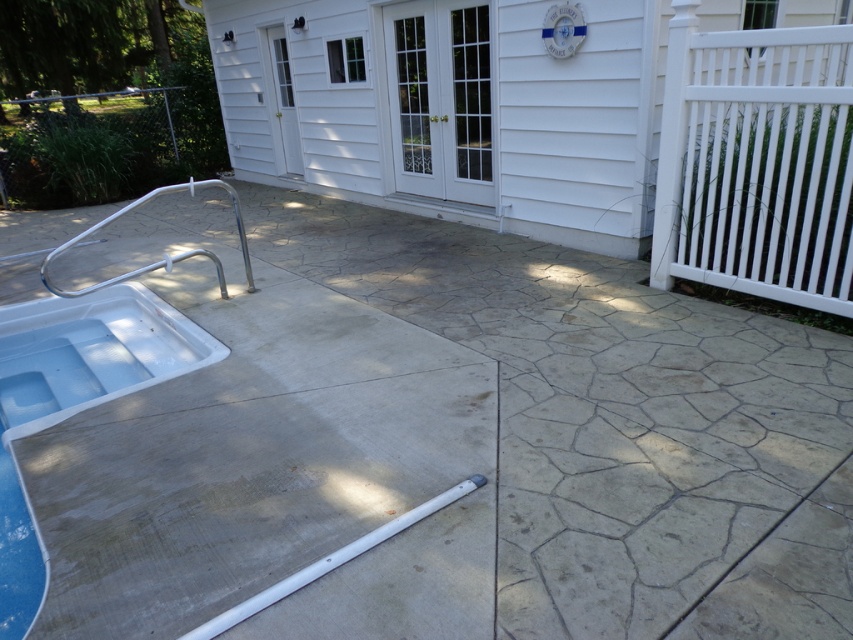
Question: Does concrete at lower left have a greater width compared to concrete textured patio at center?

Choices:
 (A) yes
 (B) no

Answer: (B)

Question: Which object appears farthest from the camera in this image?

Choices:
 (A) concrete at lower left
 (B) concrete textured patio at center

Answer: (A)

Question: Which of the following is the farthest from the observer?

Choices:
 (A) (569, 237)
 (B) (659, 492)

Answer: (A)

Question: Can you confirm if concrete at lower left is smaller than concrete textured patio at center?

Choices:
 (A) no
 (B) yes

Answer: (B)

Question: Is the position of concrete at lower left more distant than that of concrete textured patio at center?

Choices:
 (A) yes
 (B) no

Answer: (A)